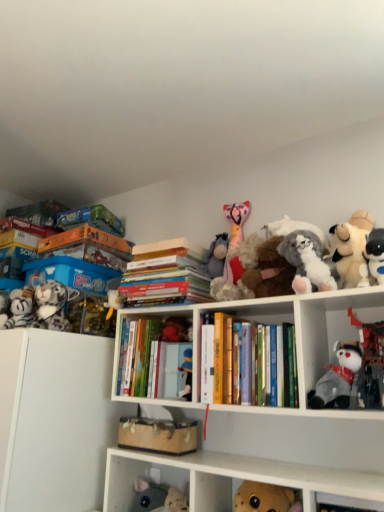
At what (x,y) coordinates should I click in order to perform the action: click on free point above hardcover books at center, placed as the 2th book when sorted from left to right (from a real-world perspective). Please return your answer as a coordinate pair (x, y). Looking at the image, I should click on (160, 264).